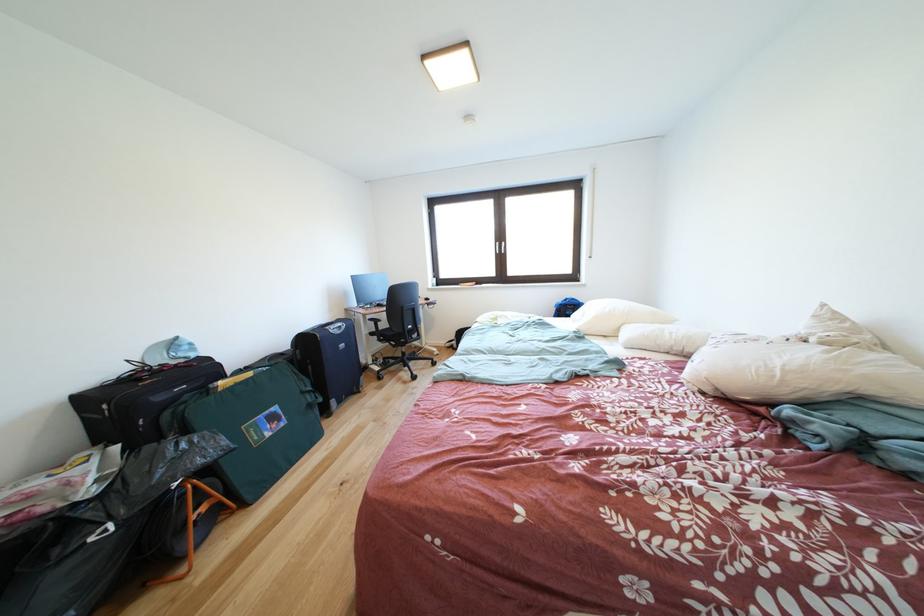
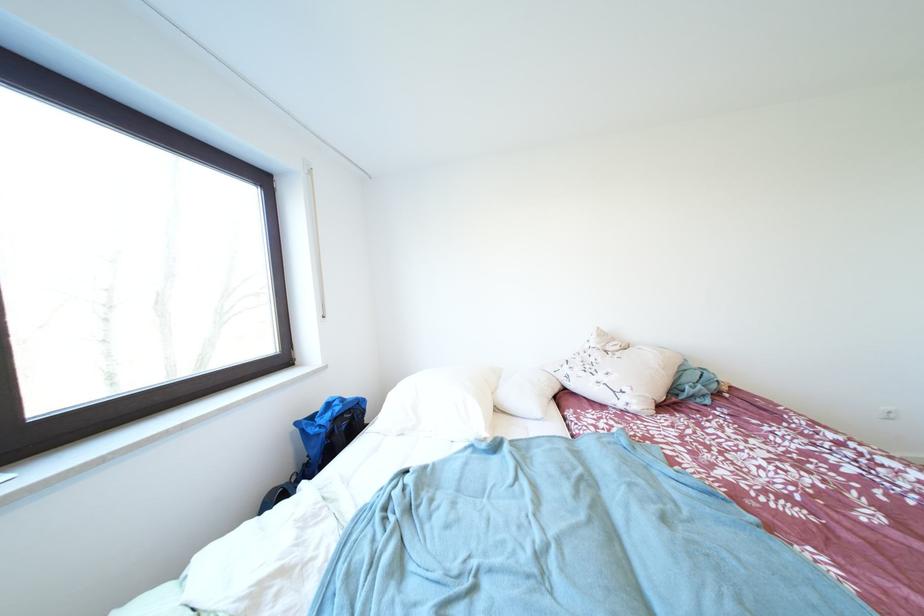
In the second image, find the point that corresponds to point 833,310 in the first image.

(606, 333)